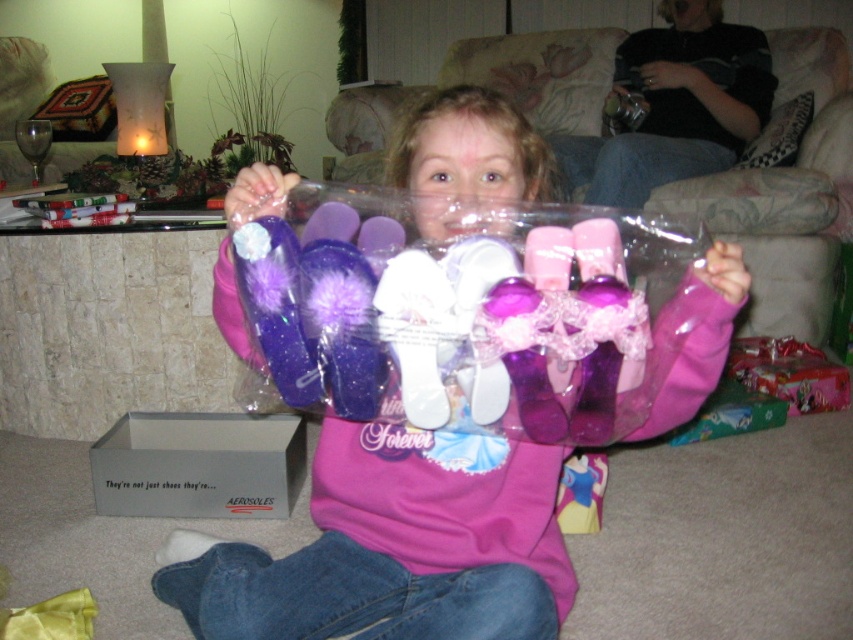
This screenshot has width=853, height=640. What do you see at coordinates (393, 547) in the screenshot?
I see `matte purple shoes at center` at bounding box center [393, 547].

Does matte purple shoes at center have a lesser width compared to gray cardboard box at lower left?

No.

The height and width of the screenshot is (640, 853). Identify the location of matte purple shoes at center. (393, 547).